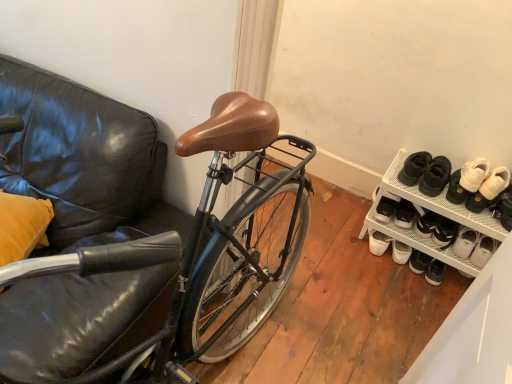
Where is `white mesh shoe rack at lower right`? This screenshot has height=384, width=512. white mesh shoe rack at lower right is located at coordinates (430, 210).

Locate an element on the screen. white suede sneakers at upper right, the 1th footwear when ordered from left to right is located at coordinates (467, 180).

Identify the location of white suede sneakers at right, marked as the first footwear in a right-to-left arrangement. The width and height of the screenshot is (512, 384). coord(488,190).

From the image's perspective, is white leather shoe at lower right on white mesh shoe rack at lower right?

Yes, from the image's perspective, white leather shoe at lower right is over white mesh shoe rack at lower right.

Is white leather shoe at lower right inside the boundaries of white mesh shoe rack at lower right, or outside?

white leather shoe at lower right is not enclosed by white mesh shoe rack at lower right.

Considering the positions of objects white leather shoe at lower right and white mesh shoe rack at lower right in the image provided, who is more to the right, white leather shoe at lower right or white mesh shoe rack at lower right?

white leather shoe at lower right.

Which is in front, point (511, 205) or point (432, 202)?

Point (511, 205)

Considering the relative sizes of white suede sneakers at right, marked as the 2th footwear in a left-to-right arrangement, and white mesh shoe rack at lower right in the image provided, is white suede sneakers at right, marked as the 2th footwear in a left-to-right arrangement, bigger than white mesh shoe rack at lower right?

Incorrect, white suede sneakers at right, marked as the 2th footwear in a left-to-right arrangement, is not larger than white mesh shoe rack at lower right.

From a real-world perspective, which is physically below, white suede sneakers at right, marked as the 2th footwear in a left-to-right arrangement, or white mesh shoe rack at lower right?

white mesh shoe rack at lower right, from a real-world perspective.

Considering the relative sizes of white suede sneakers at right, marked as the 2th footwear in a left-to-right arrangement, and white mesh shoe rack at lower right in the image provided, is white suede sneakers at right, marked as the 2th footwear in a left-to-right arrangement, shorter than white mesh shoe rack at lower right?

Yes.

From the picture: Which object is wider, white suede sneakers at right, marked as the 2th footwear in a left-to-right arrangement, or white mesh shoe rack at lower right?

With larger width is white mesh shoe rack at lower right.

Does point (451, 209) appear closer or farther from the camera than point (490, 198)?

Point (451, 209) appears to be farther away from the viewer than point (490, 198).

Are white mesh shoe rack at lower right and white suede sneakers at right, marked as the first footwear in a right-to-left arrangement, making contact?

No, white mesh shoe rack at lower right is not making contact with white suede sneakers at right, marked as the first footwear in a right-to-left arrangement.

From a real-world perspective, which is physically below, white mesh shoe rack at lower right or white suede sneakers at right, marked as the first footwear in a right-to-left arrangement?

white mesh shoe rack at lower right.

Does white mesh shoe rack at lower right have a smaller size compared to white suede sneakers at right, marked as the first footwear in a right-to-left arrangement?

No, white mesh shoe rack at lower right is not smaller than white suede sneakers at right, marked as the first footwear in a right-to-left arrangement.

Does white suede sneakers at upper right, which is the second footwear in right-to-left order, have a lesser height compared to white suede sneakers at right, marked as the 2th footwear in a left-to-right arrangement?

In fact, white suede sneakers at upper right, which is the second footwear in right-to-left order, may be taller than white suede sneakers at right, marked as the 2th footwear in a left-to-right arrangement.

Which object is closer to the camera, white suede sneakers at upper right, the 1th footwear when ordered from left to right, or white suede sneakers at right, marked as the first footwear in a right-to-left arrangement?

white suede sneakers at right, marked as the first footwear in a right-to-left arrangement, is closer to the camera.

From a real-world perspective, is white suede sneakers at upper right, the 1th footwear when ordered from left to right, positioned under white suede sneakers at right, marked as the first footwear in a right-to-left arrangement, based on gravity?

Correct, in the physical world, white suede sneakers at upper right, the 1th footwear when ordered from left to right, is lower than white suede sneakers at right, marked as the first footwear in a right-to-left arrangement.

Which of these two, white mesh shoe rack at lower right or white leather shoe at lower right, is smaller?

white leather shoe at lower right.

Could you tell me if white mesh shoe rack at lower right is turned towards white leather shoe at lower right?

No.

Between white mesh shoe rack at lower right and white leather shoe at lower right, which one has larger width?

white mesh shoe rack at lower right.

Is white suede sneakers at right, marked as the 2th footwear in a left-to-right arrangement, far away from white leather shoe at lower right?

No, white suede sneakers at right, marked as the 2th footwear in a left-to-right arrangement, is in close proximity to white leather shoe at lower right.

Identify the location of shoe below the white suede sneakers at right, marked as the 2th footwear in a left-to-right arrangement (from the image's perspective). The image size is (512, 384). pos(503,209).

Considering the relative positions of white suede sneakers at right, marked as the 2th footwear in a left-to-right arrangement, and white leather shoe at lower right in the image provided, is white suede sneakers at right, marked as the 2th footwear in a left-to-right arrangement, to the right of white leather shoe at lower right from the viewer's perspective?

Incorrect, white suede sneakers at right, marked as the 2th footwear in a left-to-right arrangement, is not on the right side of white leather shoe at lower right.

Does white suede sneakers at right, marked as the first footwear in a right-to-left arrangement, have a lesser height compared to white leather shoe at lower right?

Yes, white suede sneakers at right, marked as the first footwear in a right-to-left arrangement, is shorter than white leather shoe at lower right.

Is white leather shoe at lower right with white suede sneakers at right, marked as the first footwear in a right-to-left arrangement?

Yes, white leather shoe at lower right is right next to white suede sneakers at right, marked as the first footwear in a right-to-left arrangement, and making contact.

From a real-world perspective, does white leather shoe at lower right stand above white suede sneakers at right, marked as the first footwear in a right-to-left arrangement?

Yes.

From the image's perspective, which object appears higher, white leather shoe at lower right or white suede sneakers at right, marked as the first footwear in a right-to-left arrangement?

From the image's view, white suede sneakers at right, marked as the first footwear in a right-to-left arrangement, is above.

Considering the relative sizes of white leather shoe at lower right and white suede sneakers at right, marked as the first footwear in a right-to-left arrangement, in the image provided, is white leather shoe at lower right bigger than white suede sneakers at right, marked as the first footwear in a right-to-left arrangement,?

Incorrect, white leather shoe at lower right is not larger than white suede sneakers at right, marked as the first footwear in a right-to-left arrangement.

Where is `shoe above the white mesh shoe rack at lower right (from the image's perspective)`? shoe above the white mesh shoe rack at lower right (from the image's perspective) is located at coordinates (503, 209).

Locate an element on the screen. This screenshot has height=384, width=512. cabinetry located below the white suede sneakers at right, marked as the first footwear in a right-to-left arrangement (from the image's perspective) is located at coordinates (430, 210).

Estimate the real-world distances between objects in this image. Which object is further from white mesh shoe rack at lower right, white suede sneakers at upper right, which is the second footwear in right-to-left order, or white leather shoe at lower right?

Based on the image, white leather shoe at lower right appears to be further to white mesh shoe rack at lower right.

When comparing their distances from white mesh shoe rack at lower right, does white suede sneakers at right, marked as the 2th footwear in a left-to-right arrangement, or white suede sneakers at upper right, the 1th footwear when ordered from left to right, seem further?

The object further to white mesh shoe rack at lower right is white suede sneakers at right, marked as the 2th footwear in a left-to-right arrangement.

Estimate the real-world distances between objects in this image. Which object is closer to white suede sneakers at upper right, which is the second footwear in right-to-left order, white leather shoe at lower right or white suede sneakers at right, marked as the first footwear in a right-to-left arrangement?

white suede sneakers at right, marked as the first footwear in a right-to-left arrangement, is positioned closer to the anchor white suede sneakers at upper right, which is the second footwear in right-to-left order.

When comparing their distances from white mesh shoe rack at lower right, does white leather shoe at lower right or white suede sneakers at right, marked as the first footwear in a right-to-left arrangement, seem closer?

Based on the image, white suede sneakers at right, marked as the first footwear in a right-to-left arrangement, appears to be nearer to white mesh shoe rack at lower right.

From the image, which object appears to be farther from white suede sneakers at upper right, the 1th footwear when ordered from left to right, white leather shoe at lower right or white mesh shoe rack at lower right?

white mesh shoe rack at lower right.

Looking at the image, which one is located further to white suede sneakers at right, marked as the first footwear in a right-to-left arrangement, white leather shoe at lower right or white suede sneakers at upper right, which is the second footwear in right-to-left order?

Among the two, white leather shoe at lower right is located further to white suede sneakers at right, marked as the first footwear in a right-to-left arrangement.

From the picture: Estimate the real-world distances between objects in this image. Which object is further from white leather shoe at lower right, white mesh shoe rack at lower right or white suede sneakers at right, marked as the first footwear in a right-to-left arrangement?

white mesh shoe rack at lower right.

When comparing their distances from white suede sneakers at right, marked as the first footwear in a right-to-left arrangement, does white mesh shoe rack at lower right or white suede sneakers at upper right, which is the second footwear in right-to-left order, seem further?

white mesh shoe rack at lower right.

Find the location of a particular element. footwear between white suede sneakers at upper right, which is the second footwear in right-to-left order, and white mesh shoe rack at lower right vertically is located at coordinates (488, 190).

Locate an element on the screen. The width and height of the screenshot is (512, 384). footwear between white suede sneakers at upper right, which is the second footwear in right-to-left order, and white leather shoe at lower right is located at coordinates (488, 190).